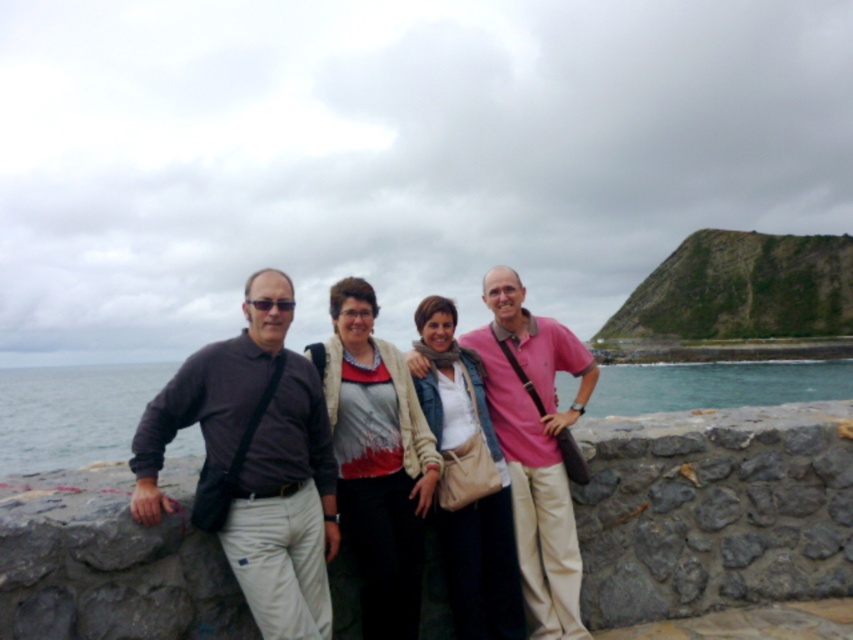
Question: Which object appears farthest from the camera in this image?

Choices:
 (A) matte gray shirt at center
 (B) pink cotton shirt at center
 (C) matte beige jacket at center
 (D) blue water at lower left

Answer: (D)

Question: Which of the following is the farthest from the observer?

Choices:
 (A) (442, 544)
 (B) (537, 632)
 (C) (360, 330)

Answer: (C)

Question: Can you confirm if dark gray shirt at center is smaller than matte red sweater at center?

Choices:
 (A) no
 (B) yes

Answer: (A)

Question: Is matte gray shirt at center behind blue water at lower left?

Choices:
 (A) no
 (B) yes

Answer: (A)

Question: Is matte gray shirt at center thinner than dark gray shirt at center?

Choices:
 (A) no
 (B) yes

Answer: (A)

Question: Among these points, which one is nearest to the camera?

Choices:
 (A) (590, 385)
 (B) (445, 403)

Answer: (B)